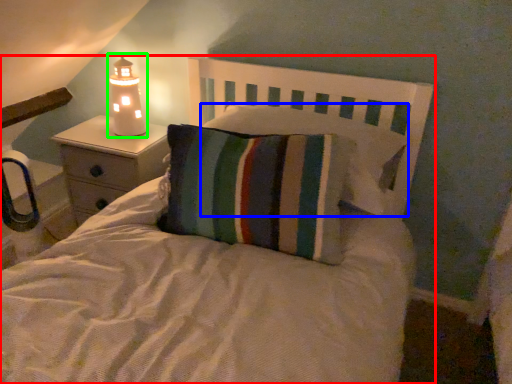
Question: Which is nearer to the bed (highlighted by a red box)? pillow (highlighted by a blue box) or lamp (highlighted by a green box).

Choices:
 (A) pillow
 (B) lamp

Answer: (A)